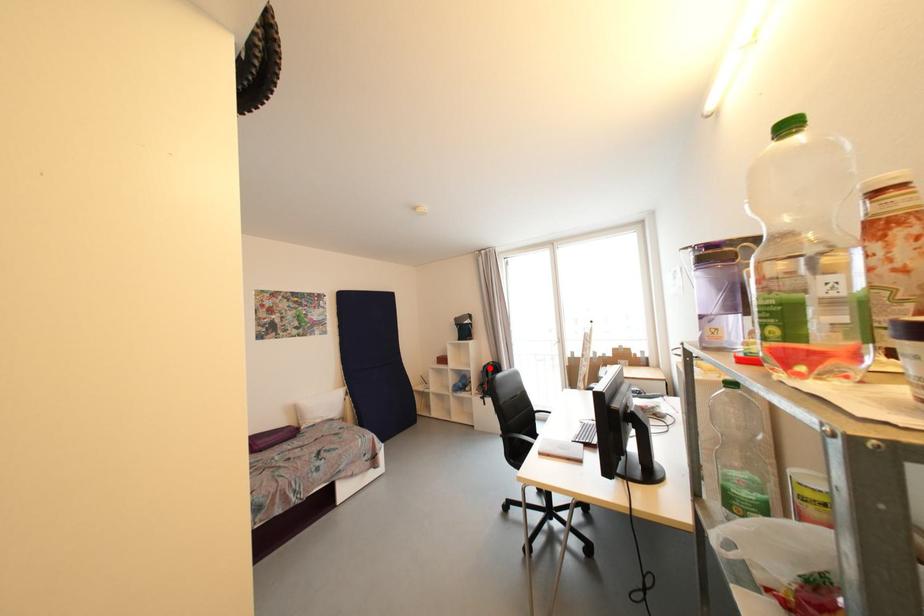
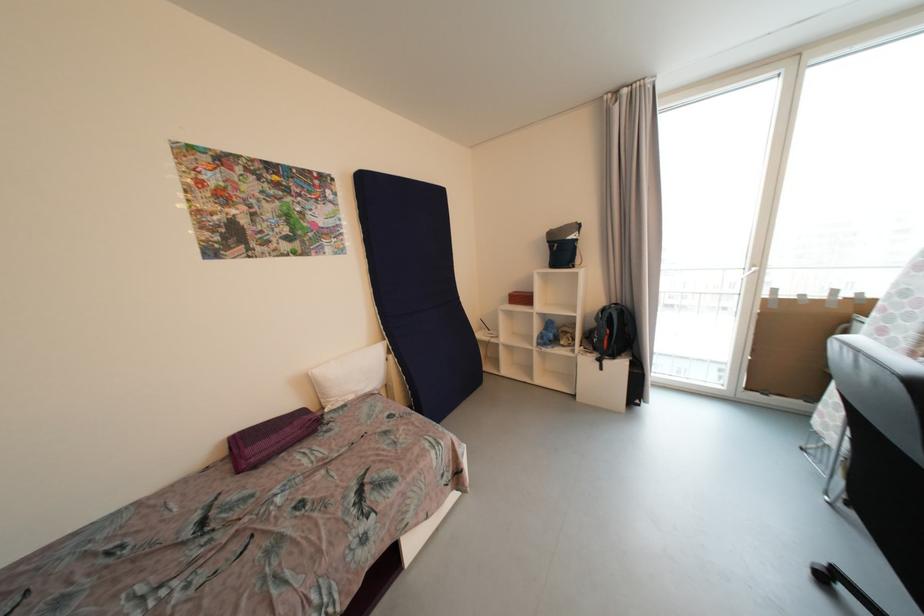
Locate, in the second image, the point that corresponds to the highlighted location in the first image.

(608, 312)